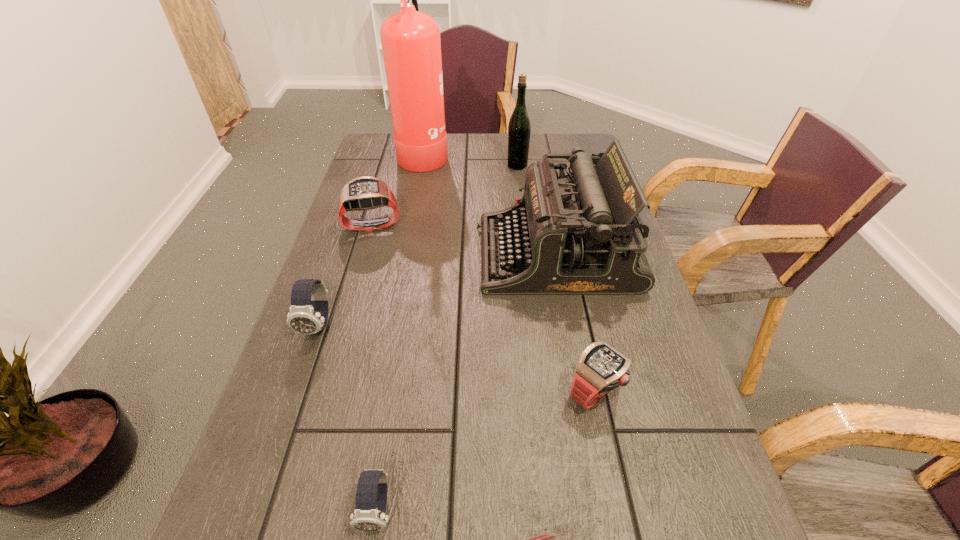
The width and height of the screenshot is (960, 540). In order to click on fire extinguisher present at the far edge in this screenshot , I will do `click(411, 44)`.

Locate an element on the screen. Image resolution: width=960 pixels, height=540 pixels. beer bottle located in the far edge section of the desktop is located at coordinates (519, 128).

I want to click on fire extinguisher at the left edge, so click(x=411, y=44).

Identify the location of typewriter present at the right edge. (577, 234).

Where is `watch located at the right edge`? The image size is (960, 540). watch located at the right edge is located at coordinates (601, 368).

Where is `object present at the far left corner`? Image resolution: width=960 pixels, height=540 pixels. object present at the far left corner is located at coordinates (411, 44).

The image size is (960, 540). I want to click on vacant space at the far edge of the desktop, so click(468, 149).

You are a GUI agent. You are given a task and a screenshot of the screen. Output one action in this format:
    pyautogui.click(x=<x>, y=<y>)
    Task: Click on the vacant space at the left edge
    
    Given the screenshot: What is the action you would take?
    [363, 341]

The height and width of the screenshot is (540, 960). In order to click on vacant space at the right edge of the desktop in this screenshot , I will do `click(647, 403)`.

Where is `vacant area at the far left corner`? vacant area at the far left corner is located at coordinates (381, 164).